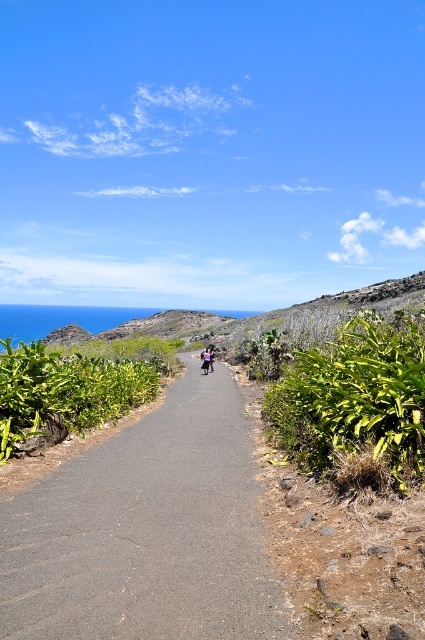
Is dark asphalt path at center to the left of green leafy shrub at center-left from the viewer's perspective?

Incorrect, dark asphalt path at center is not on the left side of green leafy shrub at center-left.

At what (x,y) coordinates should I click in order to perform the action: click on dark asphalt path at center. Please return your answer as a coordinate pair (x, y). Image resolution: width=425 pixels, height=640 pixels. Looking at the image, I should click on (147, 531).

Does dark asphalt path at center have a lesser height compared to green leafy shrub at right?

Yes.

Is point (99, 586) positioned in front of point (354, 410)?

That is True.

Locate an element on the screen. dark asphalt path at center is located at coordinates (147, 531).

Between green leafy shrub at right and green leafy shrub at center-left, which one has less height?

green leafy shrub at center-left

Between green leafy shrub at right and green leafy shrub at center-left, which one has more height?

Standing taller between the two is green leafy shrub at right.

Where is `green leafy shrub at right`? The height and width of the screenshot is (640, 425). green leafy shrub at right is located at coordinates (356, 401).